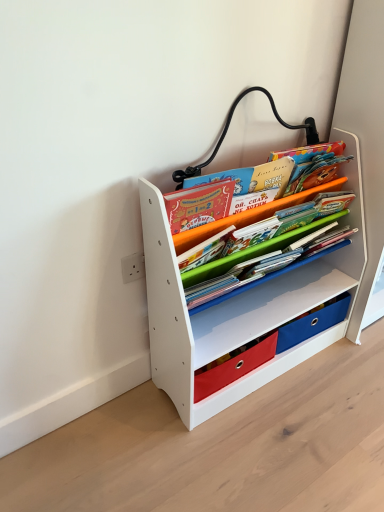
Question: Which is correct: matte paper book at center is inside white matte bookshelf at center, or outside of it?

Choices:
 (A) outside
 (B) inside

Answer: (B)

Question: Is matte paper book at center in front of or behind white matte bookshelf at center in the image?

Choices:
 (A) behind
 (B) front

Answer: (A)

Question: Considering the positions of matte paper book at center and white matte bookshelf at center in the image, is matte paper book at center bigger or smaller than white matte bookshelf at center?

Choices:
 (A) small
 (B) big

Answer: (A)

Question: Is point (172, 248) closer or farther from the camera than point (261, 217)?

Choices:
 (A) farther
 (B) closer

Answer: (B)

Question: Considering their positions, is white matte bookshelf at center located in front of or behind matte paper book at center?

Choices:
 (A) front
 (B) behind

Answer: (A)

Question: Considering the positions of white matte bookshelf at center and matte paper book at center in the image, is white matte bookshelf at center wider or thinner than matte paper book at center?

Choices:
 (A) thin
 (B) wide

Answer: (B)

Question: Is white matte bookshelf at center situated inside matte paper book at center or outside?

Choices:
 (A) inside
 (B) outside

Answer: (B)